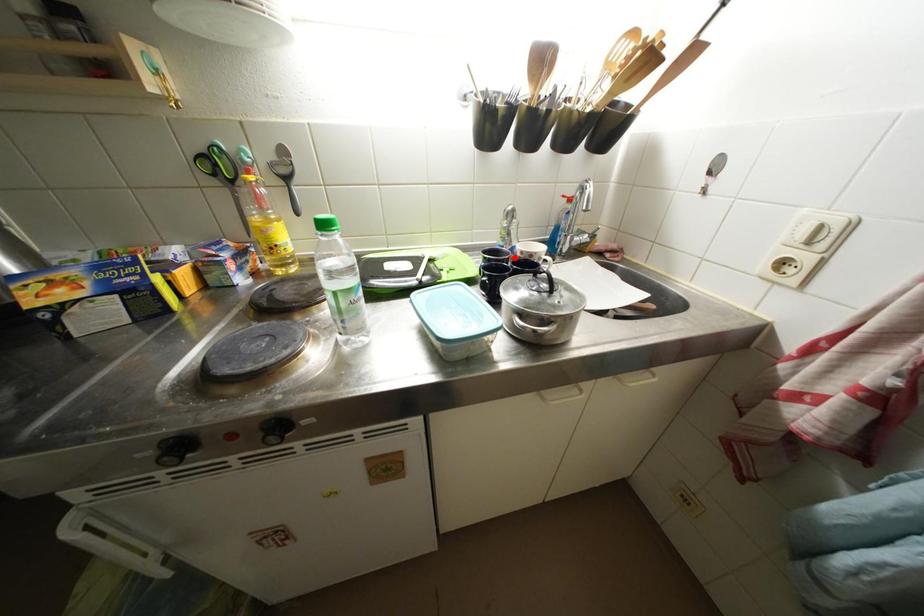
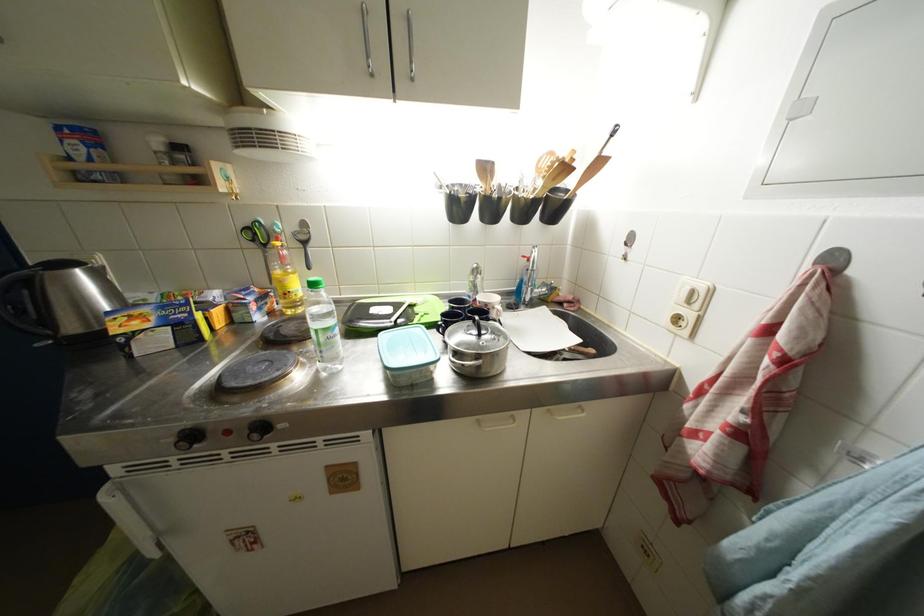
Locate, in the second image, the point that corresponds to the highlighted location in the first image.

(477, 307)